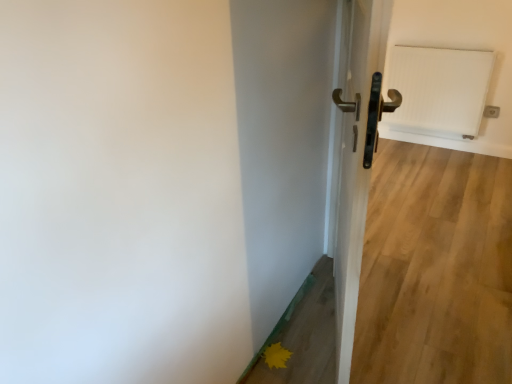
Question: Is white textured radiator at upper right in front of or behind metallic gold door handle at center in the image?

Choices:
 (A) front
 (B) behind

Answer: (B)

Question: From the image's perspective, relative to metallic gold door handle at center, is white textured radiator at upper right above or below?

Choices:
 (A) below
 (B) above

Answer: (B)

Question: Estimate the real-world distances between objects in this image. Which object is closer to the white textured radiator at upper right?

Choices:
 (A) metallic gold door handle at center
 (B) yellow matte flower at lower right

Answer: (A)

Question: Based on their relative distances, which object is farther from the white textured radiator at upper right?

Choices:
 (A) yellow matte flower at lower right
 (B) metallic gold door handle at center

Answer: (A)